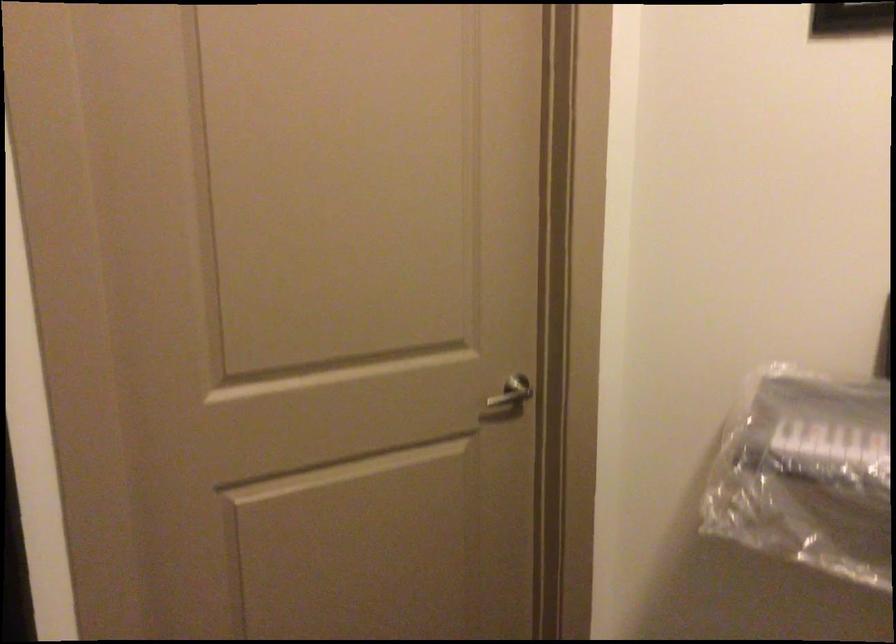
What do you see at coordinates (512, 392) in the screenshot? The width and height of the screenshot is (896, 644). I see `the silver door handle` at bounding box center [512, 392].